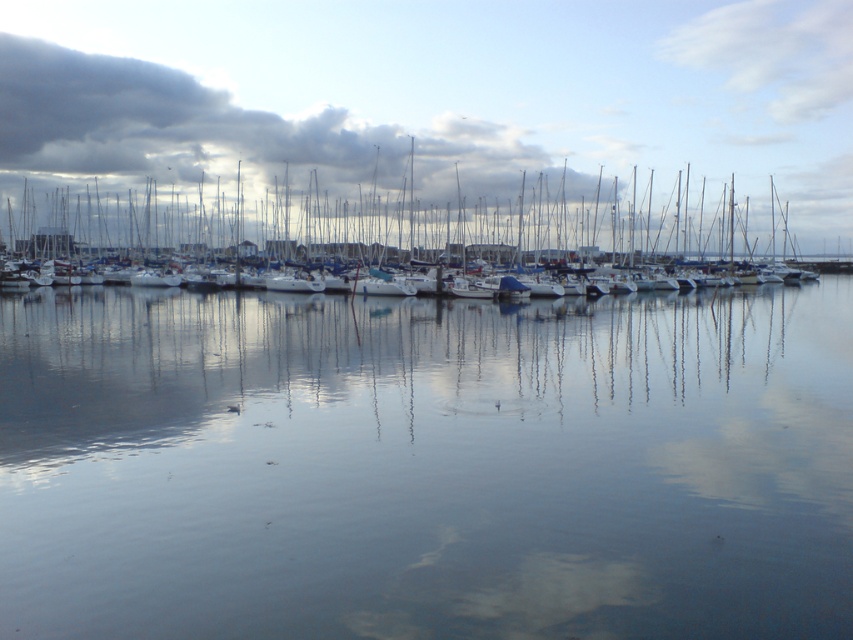
Where is `transparent water at center`? This screenshot has width=853, height=640. transparent water at center is located at coordinates (426, 465).

Is point (758, 628) positioned after point (135, 97)?

No.

I want to click on transparent water at center, so click(x=426, y=465).

Which is more to the left, white matte boats at center or dark gray cloud at upper left?

dark gray cloud at upper left is more to the left.

Is white matte boats at center shorter than dark gray cloud at upper left?

Yes.

Where is `white matte boats at center`? This screenshot has width=853, height=640. white matte boats at center is located at coordinates (369, 212).

At what (x,y) coordinates should I click in order to perform the action: click on white matte boats at center. Please return your answer as a coordinate pair (x, y). The width and height of the screenshot is (853, 640). Looking at the image, I should click on (369, 212).

Is point (51, 554) positioned after point (495, 212)?

No, it is in front of (495, 212).

Can you confirm if transparent water at center is smaller than white matte boats at center?

Yes, transparent water at center is smaller than white matte boats at center.

This screenshot has width=853, height=640. In order to click on transparent water at center in this screenshot , I will do `click(426, 465)`.